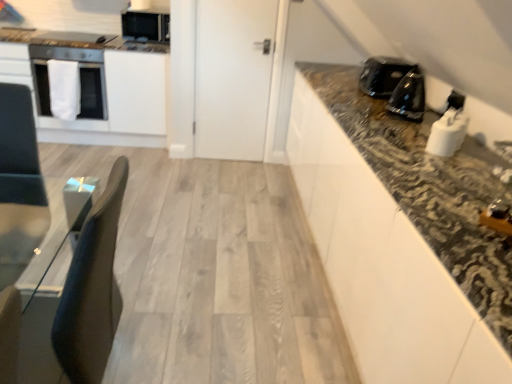
The height and width of the screenshot is (384, 512). Describe the element at coordinates (80, 78) in the screenshot. I see `white matte oven at left` at that location.

The width and height of the screenshot is (512, 384). Describe the element at coordinates (69, 46) in the screenshot. I see `metallic silver toaster at upper left, which is the 3th appliance from bottom to top` at that location.

Measure the distance between black glossy kettle at right, which ranks as the second appliance in bottom-to-top order, and camera.

black glossy kettle at right, which ranks as the second appliance in bottom-to-top order, and camera are 2.06 meters apart.

The image size is (512, 384). Describe the element at coordinates (448, 128) in the screenshot. I see `white glossy toaster at upper right, the fourth appliance viewed from the top` at that location.

Locate an element on the screen. This screenshot has width=512, height=384. black granite countertop at upper right is located at coordinates [x=431, y=189].

Can you confirm if metallic silver toaster at upper left, which appears as the 4th appliance when viewed from the right, is taller than black granite countertop at upper right?

No.

Do you think metallic silver toaster at upper left, which is counted as the 2th appliance, starting from the top, is within black granite countertop at upper right, or outside of it?

The correct answer is: outside.

Considering the relative sizes of metallic silver toaster at upper left, which is counted as the 2th appliance, starting from the top, and black granite countertop at upper right in the image provided, is metallic silver toaster at upper left, which is counted as the 2th appliance, starting from the top, thinner than black granite countertop at upper right?

Yes, metallic silver toaster at upper left, which is counted as the 2th appliance, starting from the top, is thinner than black granite countertop at upper right.

Between point (34, 49) and point (132, 14), which one is positioned in front?

Point (34, 49)

Is metallic silver toaster at upper left, which appears as the 4th appliance when viewed from the right, oriented towards matte black microwave at upper left, which is the second appliance from left to right?

No, metallic silver toaster at upper left, which appears as the 4th appliance when viewed from the right, is not facing towards matte black microwave at upper left, which is the second appliance from left to right.

Is metallic silver toaster at upper left, which appears as the 4th appliance when viewed from the right, at the left side of matte black microwave at upper left, placed as the 1th appliance when sorted from back to front?

Yes, metallic silver toaster at upper left, which appears as the 4th appliance when viewed from the right, is to the left of matte black microwave at upper left, placed as the 1th appliance when sorted from back to front.

Which is in front, black glossy coffee maker at upper right or black granite countertop at upper right?

black granite countertop at upper right is in front.

Can we say black glossy coffee maker at upper right lies outside black granite countertop at upper right?

Indeed, black glossy coffee maker at upper right is completely outside black granite countertop at upper right.

In the scene shown: Is black glossy coffee maker at upper right beside black granite countertop at upper right?

They are not placed beside each other.

In the scene shown: From the image's perspective, is black glossy coffee maker at upper right under black granite countertop at upper right?

Actually, black glossy coffee maker at upper right appears above black granite countertop at upper right in the image.

Looking at this image, from a real-world perspective, between black granite countertop at upper right and black glossy kettle at right, which ranks as the third appliance in back-to-front order, who is vertically lower?

black granite countertop at upper right, from a real-world perspective.

Is black granite countertop at upper right beside black glossy kettle at right, which appears as the 3th appliance when viewed from the top?

No, black granite countertop at upper right is not with black glossy kettle at right, which appears as the 3th appliance when viewed from the top.

Based on their sizes in the image, would you say black granite countertop at upper right is bigger or smaller than black glossy kettle at right, which appears as the 3th appliance when viewed from the top?

In the image, black granite countertop at upper right appears to be larger than black glossy kettle at right, which appears as the 3th appliance when viewed from the top.

Which object is further away from the camera taking this photo, black granite countertop at upper right or black glossy kettle at right, the second appliance in the front-to-back sequence?

black glossy kettle at right, the second appliance in the front-to-back sequence, is further away from the camera.

From the picture: From the image's perspective, is white glossy toaster at upper right, the fourth appliance from the back, located beneath white glossy oven at left?

Yes, from the image's perspective, white glossy toaster at upper right, the fourth appliance from the back, is below white glossy oven at left.

In the image, is white glossy toaster at upper right, acting as the 1th appliance starting from the right, positioned in front of or behind white glossy oven at left?

white glossy toaster at upper right, acting as the 1th appliance starting from the right, is in front of white glossy oven at left.

Considering the relative sizes of white glossy toaster at upper right, placed as the 1th appliance when sorted from bottom to top, and white glossy oven at left in the image provided, is white glossy toaster at upper right, placed as the 1th appliance when sorted from bottom to top, taller than white glossy oven at left?

Incorrect, the height of white glossy toaster at upper right, placed as the 1th appliance when sorted from bottom to top, is not larger of that of white glossy oven at left.

Considering the relative sizes of white glossy toaster at upper right, the fourth appliance viewed from the top, and white glossy oven at left in the image provided, is white glossy toaster at upper right, the fourth appliance viewed from the top, wider than white glossy oven at left?

In fact, white glossy toaster at upper right, the fourth appliance viewed from the top, might be narrower than white glossy oven at left.

What's the angular difference between white matte oven at left and black granite countertop at upper right's facing directions?

90.5 degrees separate the facing orientations of white matte oven at left and black granite countertop at upper right.

Where is `countertop directly beneath the white matte oven at left (from a real-world perspective)`? The height and width of the screenshot is (384, 512). countertop directly beneath the white matte oven at left (from a real-world perspective) is located at coordinates (431, 189).

Is white matte oven at left aimed at black granite countertop at upper right?

No, white matte oven at left is not oriented towards black granite countertop at upper right.

Is white matte oven at left touching black granite countertop at upper right?

No.

Which is in front, point (454, 134) or point (122, 32)?

The point (454, 134) is closer to the camera.

Relative to matte black microwave at upper left, acting as the 3th appliance starting from the right, is white glossy toaster at upper right, the fourth appliance from the back, in front or behind?

white glossy toaster at upper right, the fourth appliance from the back, is in front of matte black microwave at upper left, acting as the 3th appliance starting from the right.

Can you tell me how much white glossy toaster at upper right, which is the 1th appliance in front-to-back order, and matte black microwave at upper left, which is the second appliance from left to right, differ in facing direction?

91.7 degrees separate the facing orientations of white glossy toaster at upper right, which is the 1th appliance in front-to-back order, and matte black microwave at upper left, which is the second appliance from left to right.

From the image's perspective, which is above, white glossy toaster at upper right, placed as the 1th appliance when sorted from bottom to top, or matte black microwave at upper left, the first appliance from the top?

matte black microwave at upper left, the first appliance from the top, appears higher in the image.

This screenshot has height=384, width=512. What are the coordinates of `appliance that is the 2nd one when counting leftward from the black granite countertop at upper right` in the screenshot? It's located at (69, 46).

Where is `appliance that is behind the metallic silver toaster at upper left, which is counted as the 2th appliance, starting from the top`? The image size is (512, 384). appliance that is behind the metallic silver toaster at upper left, which is counted as the 2th appliance, starting from the top is located at coordinates (146, 26).

Based on the photo, from the image, which object appears to be farther from black glossy coffee maker at upper right, metallic silver toaster at upper left, which is the 3th appliance from bottom to top, or white matte oven at left?

Among the two, white matte oven at left is located further to black glossy coffee maker at upper right.

Which object lies nearer to the anchor point metallic silver toaster at upper left, the first appliance from the left, white glossy oven at left or white matte oven at left?

white matte oven at left lies closer to metallic silver toaster at upper left, the first appliance from the left, than the other object.

Considering their positions, is black glossy kettle at right, which ranks as the second appliance in bottom-to-top order, positioned closer to matte black microwave at upper left, the first appliance from the top, than white matte oven at left?

Among the two, white matte oven at left is located nearer to matte black microwave at upper left, the first appliance from the top.

Based on their spatial positions, is white glossy toaster at upper right, acting as the 1th appliance starting from the right, or black glossy kettle at right, the second appliance in the front-to-back sequence, closer to metallic silver toaster at upper left, which is counted as the 2th appliance, starting from the top?

black glossy kettle at right, the second appliance in the front-to-back sequence, is closer to metallic silver toaster at upper left, which is counted as the 2th appliance, starting from the top.

Considering their positions, is white glossy oven at left positioned further to black glossy coffee maker at upper right than black glossy kettle at right, the second appliance in the front-to-back sequence?

white glossy oven at left is positioned further to the anchor black glossy coffee maker at upper right.

Estimate the real-world distances between objects in this image. Which object is closer to white glossy toaster at upper right, the fourth appliance viewed from the top, metallic silver toaster at upper left, which is the 3th appliance from bottom to top, or white glossy oven at left?

Among the two, white glossy oven at left is located nearer to white glossy toaster at upper right, the fourth appliance viewed from the top.

Based on their spatial positions, is black glossy coffee maker at upper right or white glossy toaster at upper right, acting as the 1th appliance starting from the right, further from black granite countertop at upper right?

Among the two, black glossy coffee maker at upper right is located further to black granite countertop at upper right.

Considering their positions, is white glossy toaster at upper right, the fourth appliance viewed from the top, positioned further to matte black microwave at upper left, the first appliance from the top, than black granite countertop at upper right?

white glossy toaster at upper right, the fourth appliance viewed from the top, is further to matte black microwave at upper left, the first appliance from the top.

The height and width of the screenshot is (384, 512). I want to click on kitchen appliance between metallic silver toaster at upper left, which is the 3th appliance from bottom to top, and white glossy toaster at upper right, marked as the fourth appliance in a left-to-right arrangement, so click(x=382, y=75).

The image size is (512, 384). Identify the location of appliance located between white matte oven at left and matte black microwave at upper left, placed as the 1th appliance when sorted from back to front, in the left-right direction. (69, 46).

This screenshot has height=384, width=512. What are the coordinates of `home appliance between metallic silver toaster at upper left, the first appliance from the left, and white glossy oven at left from top to bottom` in the screenshot? It's located at (80, 78).

The height and width of the screenshot is (384, 512). I want to click on appliance situated between white glossy oven at left and matte black microwave at upper left, which is the second appliance from left to right, from left to right, so click(69, 46).